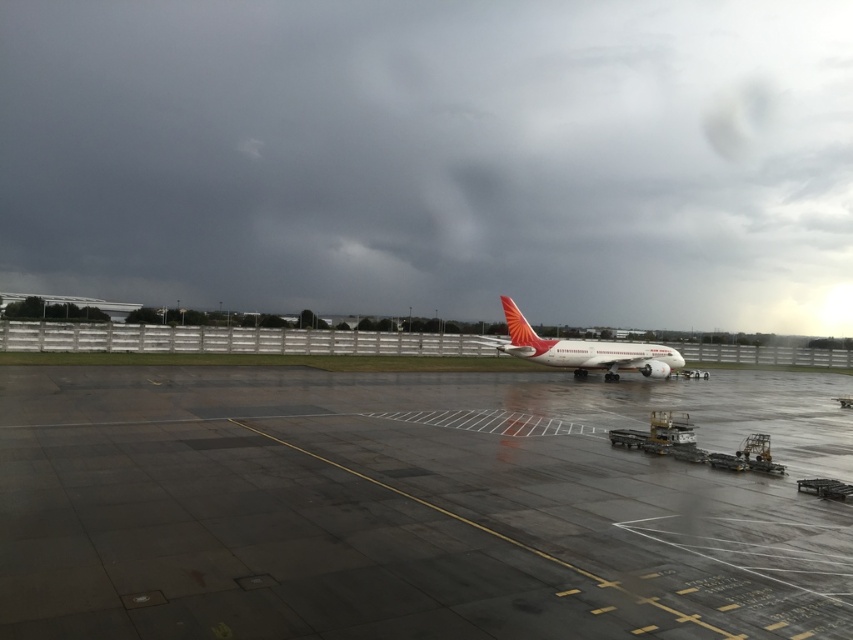
Question: Estimate the real-world distances between objects in this image. Which object is closer to the white matte airplane at center?

Choices:
 (A) concrete wet tarmac at center
 (B) dark gray cloud at upper center

Answer: (A)

Question: Which point is closer to the camera taking this photo?

Choices:
 (A) (479, 384)
 (B) (657, 112)

Answer: (A)

Question: Is dark gray cloud at upper center smaller than concrete wet tarmac at center?

Choices:
 (A) yes
 (B) no

Answer: (B)

Question: Does dark gray cloud at upper center have a greater width compared to white matte airplane at center?

Choices:
 (A) no
 (B) yes

Answer: (B)

Question: In this image, where is concrete wet tarmac at center located relative to white matte airplane at center?

Choices:
 (A) above
 (B) below

Answer: (B)

Question: Which object is the farthest from the white matte airplane at center?

Choices:
 (A) concrete wet tarmac at center
 (B) dark gray cloud at upper center

Answer: (B)